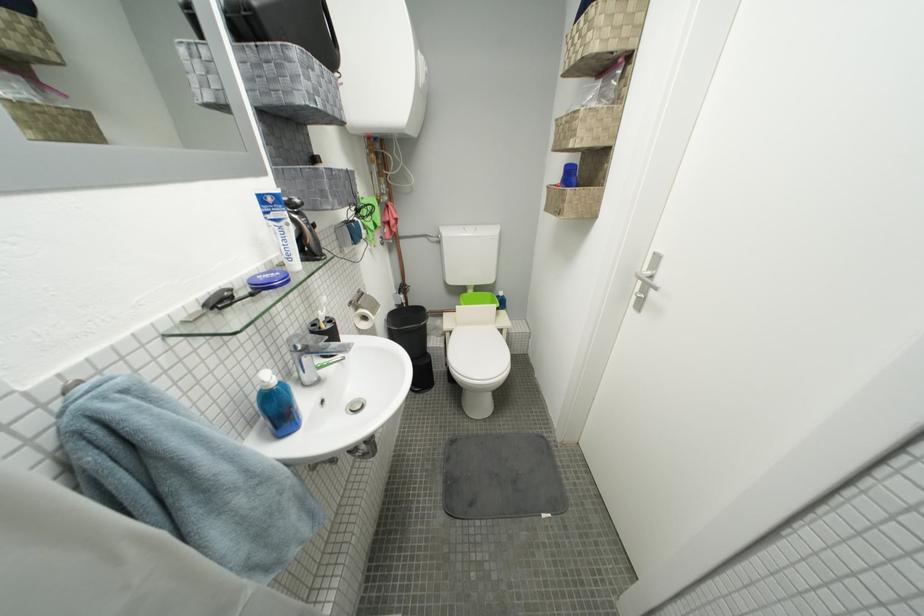
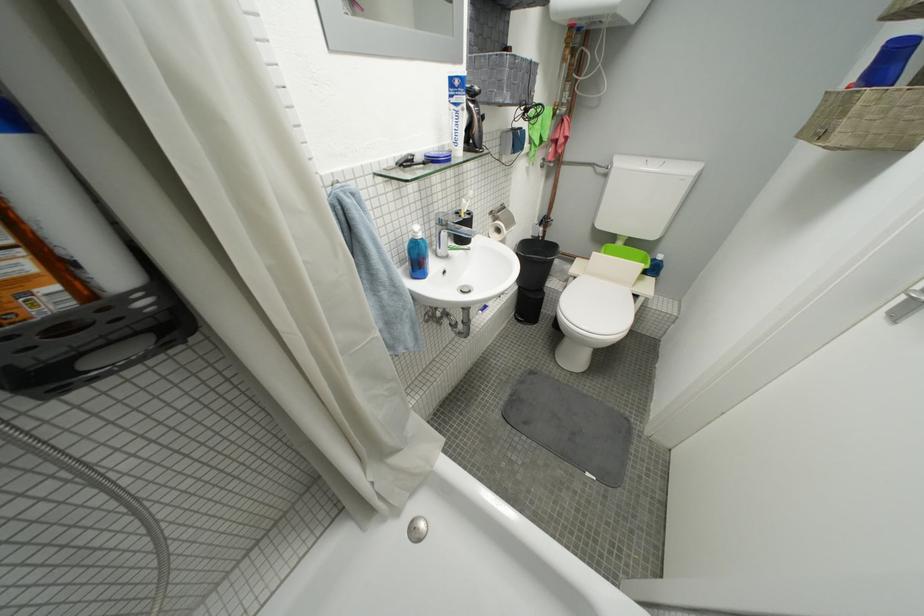
Question: I am providing you with two images of the same scene from different viewpoints. Please identify which objects are invisible in image2.

Choices:
 (A) toilet lid
 (B) blue bottle
 (C) black trash can
 (D) none of these

Answer: (D)